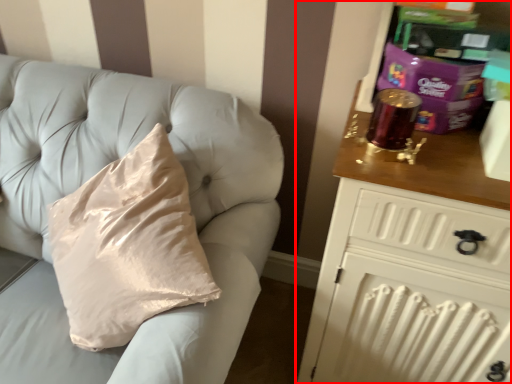
Question: Observing the image, what is the correct spatial positioning of chest of drawers (annotated by the red box) in reference to furniture?

Choices:
 (A) right
 (B) left

Answer: (A)